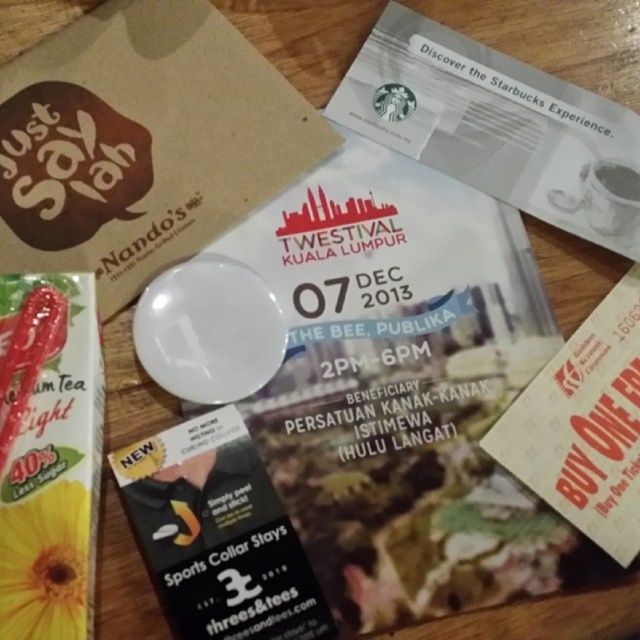
You are organizing items on a table and need to place the black matte sports collar stays at center and the white ceramic mug at upper right. According to the scene, where should you position the collar stays relative to the mug?

The black matte sports collar stays at center should be positioned under the white ceramic mug at upper right as described.

You are organizing items on a table and need to stack the black matte sports collar stays at center and the white ceramic mug at upper right. Which item should you place at the bottom to ensure stability?

The black matte sports collar stays at center has a greater height compared to the white ceramic mug at upper right. To ensure stability, place the taller item, the black matte sports collar stays at center, at the bottom.

You have a small sticker that is 5 cm wide. You want to place it on either the yellow paper at lower left or the white ceramic mug at upper right. Which object can the sticker fit on without overlapping the edges?

The yellow paper at lower left has a larger width than the white ceramic mug at upper right. Since the sticker is 5 cm wide, it can fit on the yellow paper at lower left as its width is sufficient. However, the white ceramic mug at upper right might be narrower, so the sticker might not fit without overlapping.